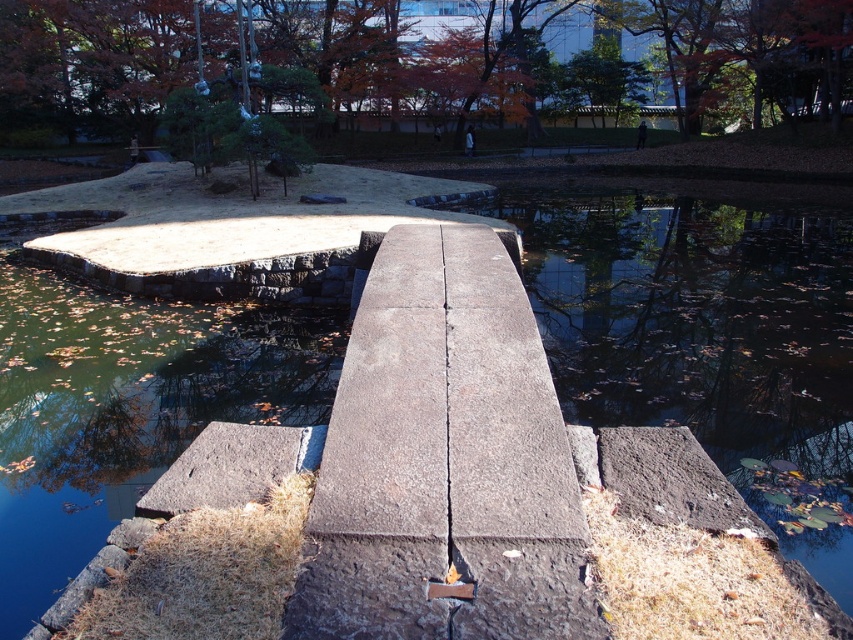
Question: Is gray concrete bench at center behind orange autumn leaves at upper center?

Choices:
 (A) yes
 (B) no

Answer: (B)

Question: Can you confirm if gray concrete bench at center is positioned above orange autumn leaves at upper center?

Choices:
 (A) yes
 (B) no

Answer: (B)

Question: Can you confirm if gray concrete bench at center is bigger than orange autumn leaves at upper center?

Choices:
 (A) no
 (B) yes

Answer: (A)

Question: Among these objects, which one is farthest from the camera?

Choices:
 (A) gray concrete bench at center
 (B) orange autumn leaves at upper center

Answer: (B)

Question: Which object appears closest to the camera in this image?

Choices:
 (A) orange autumn leaves at upper center
 (B) gray concrete bench at center

Answer: (B)